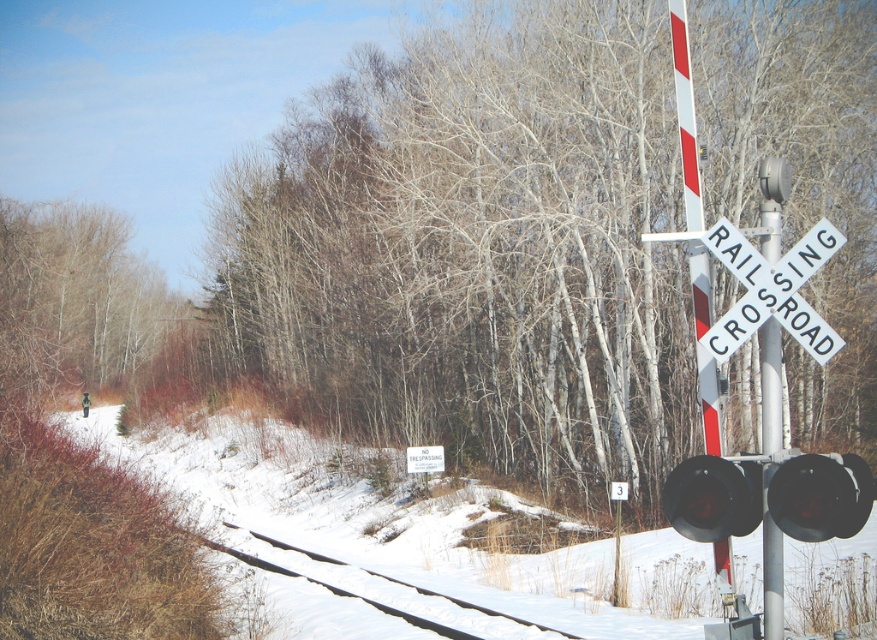
You are a delivery driver approaching the railroad crossing and need to decide whether to proceed. Based on the image, which object, the black metal train track at lower left or the black matte traffic light at center right, is wider in the scene?

The black metal train track at lower left might be wider than black matte traffic light at center right according to the description, so the train track is likely wider than the traffic light.

You are a delivery driver approaching the railroad crossing. You need to know if the white plastic railroad crossing sign at upper right is wider than the white wooden sign at center to decide your route. Based on the scene, can you determine which is wider?

The white plastic railroad crossing sign at upper right is less wide than the white wooden sign at center, so the wooden sign is wider.